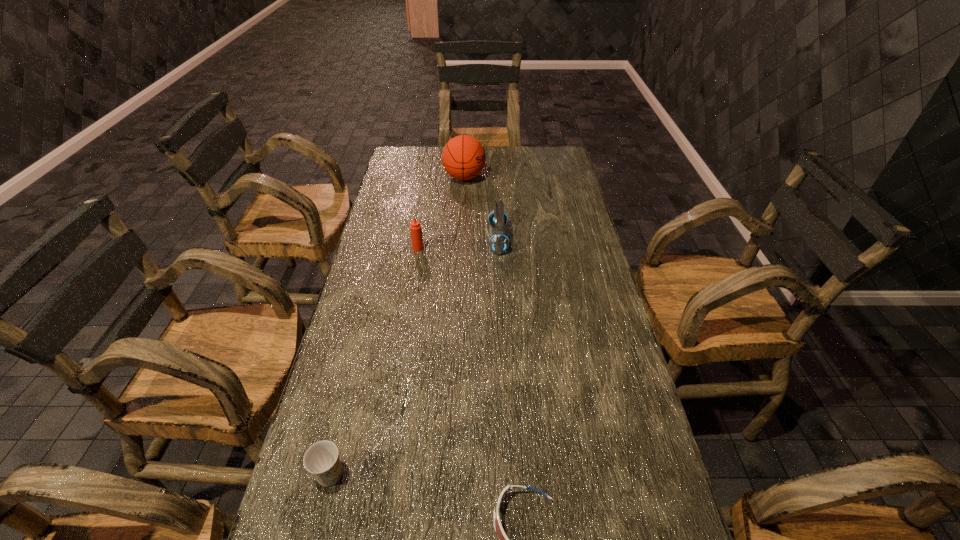
Locate an element on the screen. The image size is (960, 540). vacant position located on the right of the fourth object from right to left is located at coordinates (486, 248).

Identify the location of free space located 0.080m on the right of the Dixie cup. (383, 474).

Identify the location of object present at the far edge. Image resolution: width=960 pixels, height=540 pixels. (463, 157).

Identify the location of Tabasco sauce at the left edge. (415, 227).

Where is `Dixie cup situated at the left edge`? The width and height of the screenshot is (960, 540). Dixie cup situated at the left edge is located at coordinates (322, 460).

This screenshot has width=960, height=540. I want to click on vacant space at the left edge of the desktop, so tap(369, 301).

You are a GUI agent. You are given a task and a screenshot of the screen. Output one action in this format:
    pyautogui.click(x=<x>, y=<y>)
    Task: Click on the vacant space at the right edge of the desktop
    The width and height of the screenshot is (960, 540).
    Given the screenshot: What is the action you would take?
    pyautogui.click(x=566, y=182)

Where is `vacant space at the far left corner of the desktop`? The width and height of the screenshot is (960, 540). vacant space at the far left corner of the desktop is located at coordinates (394, 171).

In the image, there is a desktop. At what (x,y) coordinates should I click in order to perform the action: click on vacant space at the far right corner. Please return your answer as a coordinate pair (x, y). The image size is (960, 540). Looking at the image, I should click on (551, 148).

I want to click on vacant space that's between the basketball and the headset, so coord(481,208).